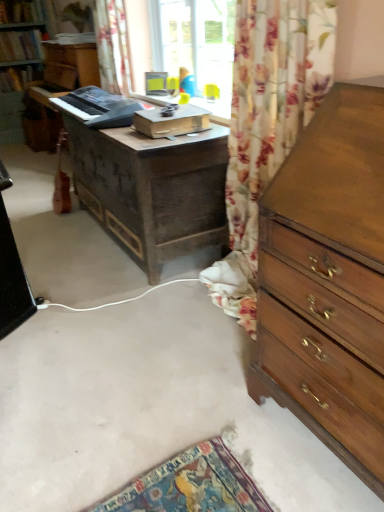
Locate an element on the screen. The width and height of the screenshot is (384, 512). black plastic keyboard at center is located at coordinates (98, 106).

Describe the element at coordinates (150, 186) in the screenshot. I see `dark brown wooden desk at center` at that location.

Describe the element at coordinates (328, 281) in the screenshot. I see `wooden chest of drawers at right` at that location.

What is the approximate height of floral fabric curtain at upper center?

73.79 centimeters.

Where is `floral fabric curtain at upper center`? This screenshot has width=384, height=512. floral fabric curtain at upper center is located at coordinates tap(112, 46).

I want to click on black plastic keyboard at center, so click(98, 106).

Can you confirm if wooden chest of drawers at right is positioned to the right of black plastic keyboard at center?

Correct, you'll find wooden chest of drawers at right to the right of black plastic keyboard at center.

Is black plastic keyboard at center inside wooden chest of drawers at right?

No, wooden chest of drawers at right does not contain black plastic keyboard at center.

Considering the relative sizes of wooden chest of drawers at right and black plastic keyboard at center in the image provided, is wooden chest of drawers at right taller than black plastic keyboard at center?

Indeed, wooden chest of drawers at right has a greater height compared to black plastic keyboard at center.

Between dark brown wooden desk at center and floral fabric curtain at upper center, which one appears on the right side from the viewer's perspective?

dark brown wooden desk at center is more to the right.

From a real-world perspective, which object stands above the other?

floral fabric curtain at upper center, from a real-world perspective.

Could you tell me if dark brown wooden desk at center is facing floral fabric curtain at upper center?

No, dark brown wooden desk at center is not turned towards floral fabric curtain at upper center.

Between dark brown wooden desk at center and floral fabric curtain at upper center, which one is positioned behind?

floral fabric curtain at upper center is more distant.

Who is bigger, floral fabric curtain at upper center or black plastic keyboard at center?

With larger size is floral fabric curtain at upper center.

From the picture: Is floral fabric curtain at upper center looking in the opposite direction of black plastic keyboard at center?

floral fabric curtain at upper center is not turned away from black plastic keyboard at center.

From the image's perspective, is floral fabric curtain at upper center on black plastic keyboard at center?

Yes.

From a real-world perspective, does wooden chest of drawers at right stand above dark brown wooden desk at center?

Indeed, from a real-world perspective, wooden chest of drawers at right stands above dark brown wooden desk at center.

Measure the distance from wooden chest of drawers at right to dark brown wooden desk at center.

wooden chest of drawers at right and dark brown wooden desk at center are 1.18 meters apart from each other.

Are wooden chest of drawers at right and dark brown wooden desk at center making contact?

No.

Considering the points (371, 327) and (150, 221), which point is behind, point (371, 327) or point (150, 221)?

The point (150, 221) is farther.

Considering the relative positions of black plastic keyboard at center and wooden chest of drawers at right in the image provided, is black plastic keyboard at center in front of wooden chest of drawers at right?

That is False.

Is point (99, 103) closer to viewer compared to point (291, 324)?

That is False.

From the image's perspective, which is above, black plastic keyboard at center or wooden chest of drawers at right?

black plastic keyboard at center appears higher in the image.

Is floral fabric curtain at upper center shorter than dark brown wooden desk at center?

No, floral fabric curtain at upper center is not shorter than dark brown wooden desk at center.

Is floral fabric curtain at upper center positioned far away from dark brown wooden desk at center?

Absolutely, floral fabric curtain at upper center is distant from dark brown wooden desk at center.

Is floral fabric curtain at upper center facing away from dark brown wooden desk at center?

floral fabric curtain at upper center does not have its back to dark brown wooden desk at center.

Is point (128, 84) closer or farther from the camera than point (175, 220)?

Point (128, 84) is positioned farther from the camera compared to point (175, 220).

From the image's perspective, who appears lower, floral fabric curtain at upper center or wooden chest of drawers at right?

wooden chest of drawers at right, from the image's perspective.

Where is `curtain above the wooden chest of drawers at right (from the image's perspective)`? curtain above the wooden chest of drawers at right (from the image's perspective) is located at coordinates (112, 46).

Is wooden chest of drawers at right at the back of floral fabric curtain at upper center?

No, wooden chest of drawers at right is not at the back of floral fabric curtain at upper center.

Image resolution: width=384 pixels, height=512 pixels. Identify the location of the chest of drawers below the black plastic keyboard at center (from a real-world perspective). (328, 281).

Find the location of a particular element. The width and height of the screenshot is (384, 512). curtain that appears on the left of dark brown wooden desk at center is located at coordinates (112, 46).

From the picture: When comparing their distances from black plastic keyboard at center, does dark brown wooden desk at center or wooden chest of drawers at right seem closer?

The object closer to black plastic keyboard at center is dark brown wooden desk at center.

Looking at the image, which one is located further to dark brown wooden desk at center, floral fabric curtain at upper center or black plastic keyboard at center?

floral fabric curtain at upper center is positioned further to the anchor dark brown wooden desk at center.

From the image, which object appears to be farther from wooden chest of drawers at right, black plastic keyboard at center or floral fabric curtain at upper center?

floral fabric curtain at upper center is further to wooden chest of drawers at right.

Based on their spatial positions, is wooden chest of drawers at right or dark brown wooden desk at center closer to floral fabric curtain at upper center?

The object closer to floral fabric curtain at upper center is dark brown wooden desk at center.

Based on their spatial positions, is wooden chest of drawers at right or black plastic keyboard at center closer to floral fabric curtain at upper center?

black plastic keyboard at center lies closer to floral fabric curtain at upper center than the other object.

Estimate the real-world distances between objects in this image. Which object is closer to dark brown wooden desk at center, wooden chest of drawers at right or floral fabric curtain at upper center?

floral fabric curtain at upper center is closer to dark brown wooden desk at center.

Estimate the real-world distances between objects in this image. Which object is further from floral fabric curtain at upper center, black plastic keyboard at center or dark brown wooden desk at center?

dark brown wooden desk at center.

Looking at the image, which one is located further to black plastic keyboard at center, floral fabric curtain at upper center or dark brown wooden desk at center?

floral fabric curtain at upper center.

Find the location of a particular element. This screenshot has height=512, width=384. desk between wooden chest of drawers at right and black plastic keyboard at center in the front-back direction is located at coordinates (150, 186).

The height and width of the screenshot is (512, 384). Find the location of `equipment that lies between floral fabric curtain at upper center and dark brown wooden desk at center from top to bottom`. equipment that lies between floral fabric curtain at upper center and dark brown wooden desk at center from top to bottom is located at coordinates (98, 106).

Find the location of `desk between wooden chest of drawers at right and floral fabric curtain at upper center along the z-axis`. desk between wooden chest of drawers at right and floral fabric curtain at upper center along the z-axis is located at coordinates (150, 186).

Where is `equipment between wooden chest of drawers at right and floral fabric curtain at upper center in the front-back direction`? equipment between wooden chest of drawers at right and floral fabric curtain at upper center in the front-back direction is located at coordinates (98, 106).